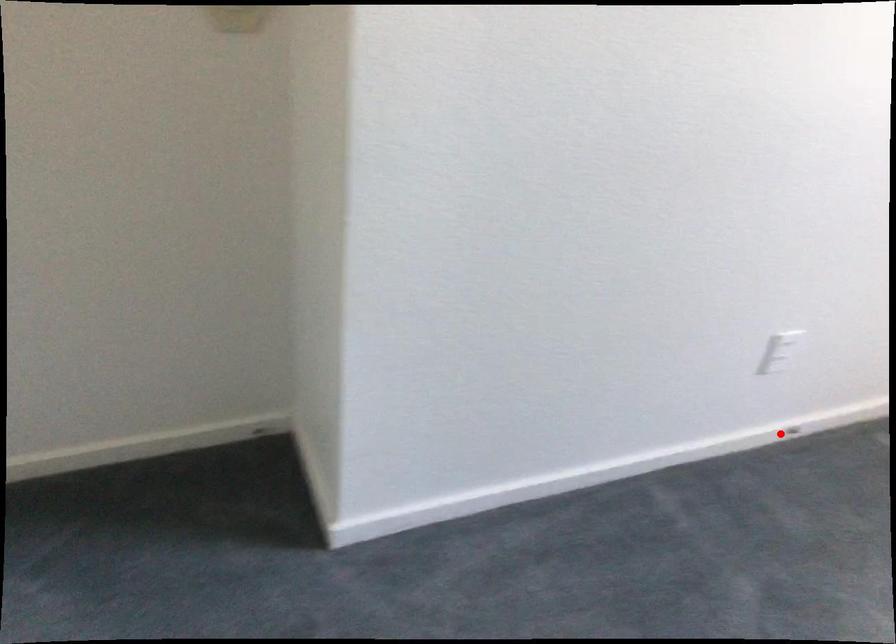
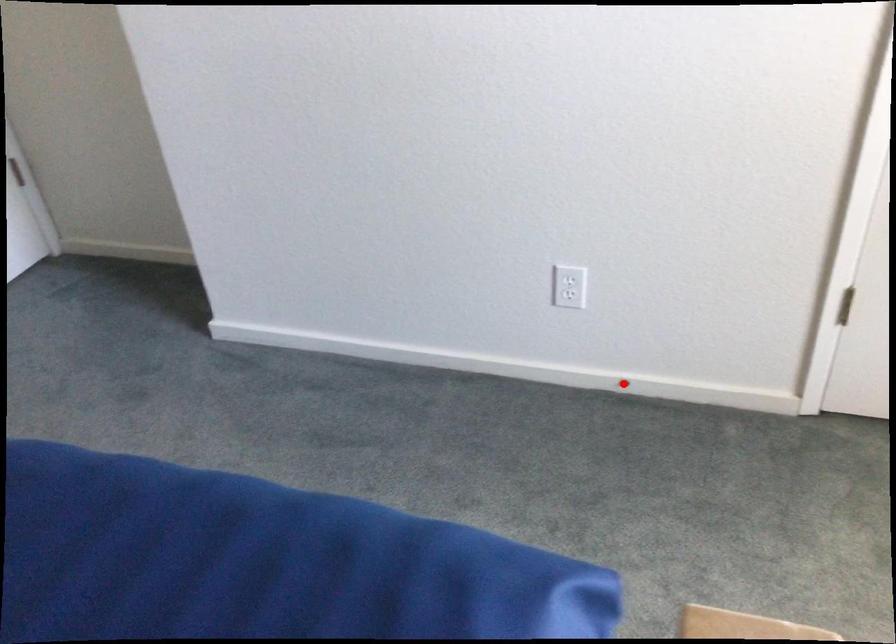
I am providing you with two images of the same scene from different viewpoints. A red point is marked on the first image and another point is marked on the second image. Is the red point in image1 aligned with the point shown in image2?

Yes